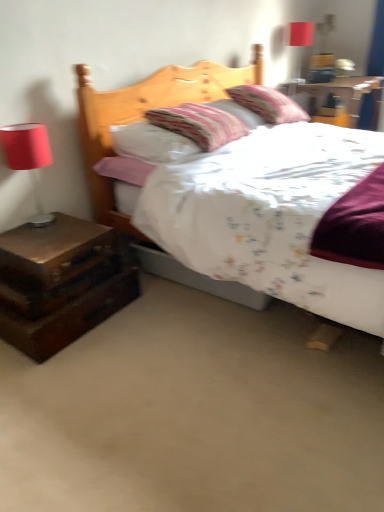
I want to click on unoccupied region to the right of matte red lampshade at upper right, so click(317, 81).